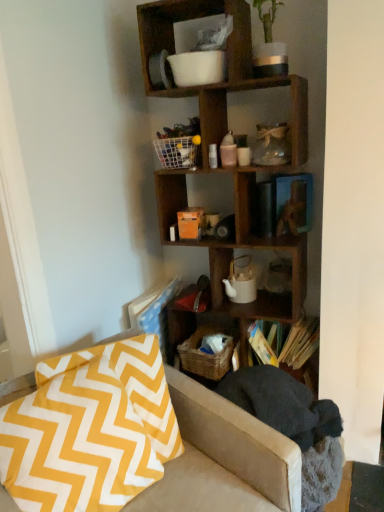
Question: Is white mesh basket at upper center wider than yellow and white zigzag fabric at lower left?

Choices:
 (A) yes
 (B) no

Answer: (B)

Question: Can you confirm if white mesh basket at upper center is shorter than yellow and white zigzag fabric at lower left?

Choices:
 (A) no
 (B) yes

Answer: (B)

Question: Considering the relative positions of white mesh basket at upper center and yellow and white zigzag fabric at lower left in the image provided, is white mesh basket at upper center to the right of yellow and white zigzag fabric at lower left from the viewer's perspective?

Choices:
 (A) no
 (B) yes

Answer: (B)

Question: From the image's perspective, is white mesh basket at upper center over yellow and white zigzag fabric at lower left?

Choices:
 (A) yes
 (B) no

Answer: (A)

Question: Can you confirm if white mesh basket at upper center is taller than yellow and white zigzag fabric at lower left?

Choices:
 (A) no
 (B) yes

Answer: (A)

Question: From a real-world perspective, is yellow and white zigzag fabric at lower left positioned above or below hardcover books at center?

Choices:
 (A) above
 (B) below

Answer: (B)

Question: Based on their sizes in the image, would you say yellow and white zigzag fabric at lower left is bigger or smaller than hardcover books at center?

Choices:
 (A) small
 (B) big

Answer: (B)

Question: Considering their positions, is yellow and white zigzag fabric at lower left located in front of or behind hardcover books at center?

Choices:
 (A) front
 (B) behind

Answer: (A)

Question: From their relative heights in the image, would you say yellow and white zigzag fabric at lower left is taller or shorter than hardcover books at center?

Choices:
 (A) short
 (B) tall

Answer: (B)

Question: From the image's perspective, is yellow and white zigzag fabric at lower left above or below wooden shelf at upper center?

Choices:
 (A) above
 (B) below

Answer: (B)

Question: In the image, is yellow and white zigzag fabric at lower left positioned in front of or behind wooden shelf at upper center?

Choices:
 (A) front
 (B) behind

Answer: (A)

Question: Does point (200, 499) appear closer or farther from the camera than point (246, 18)?

Choices:
 (A) farther
 (B) closer

Answer: (B)

Question: In terms of size, does yellow and white zigzag fabric at lower left appear bigger or smaller than wooden shelf at upper center?

Choices:
 (A) small
 (B) big

Answer: (B)

Question: From the image's perspective, is wooden shelf at upper center located above or below yellow and white zigzag fabric at lower left?

Choices:
 (A) below
 (B) above

Answer: (B)

Question: Considering the positions of wooden shelf at upper center and yellow and white zigzag fabric at lower left in the image, is wooden shelf at upper center wider or thinner than yellow and white zigzag fabric at lower left?

Choices:
 (A) wide
 (B) thin

Answer: (B)